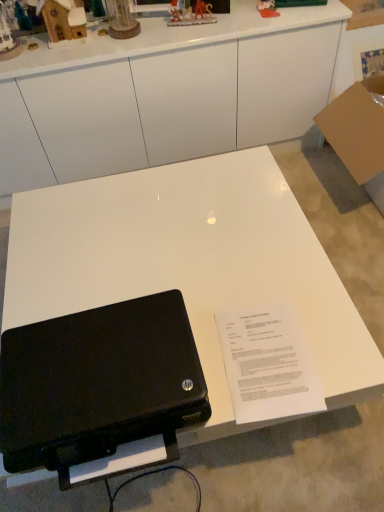
Find the location of `vacant area that is situated to the right of wooden house at upper left, which ranks as the first toy in left-to-right order`. vacant area that is situated to the right of wooden house at upper left, which ranks as the first toy in left-to-right order is located at coordinates (46, 52).